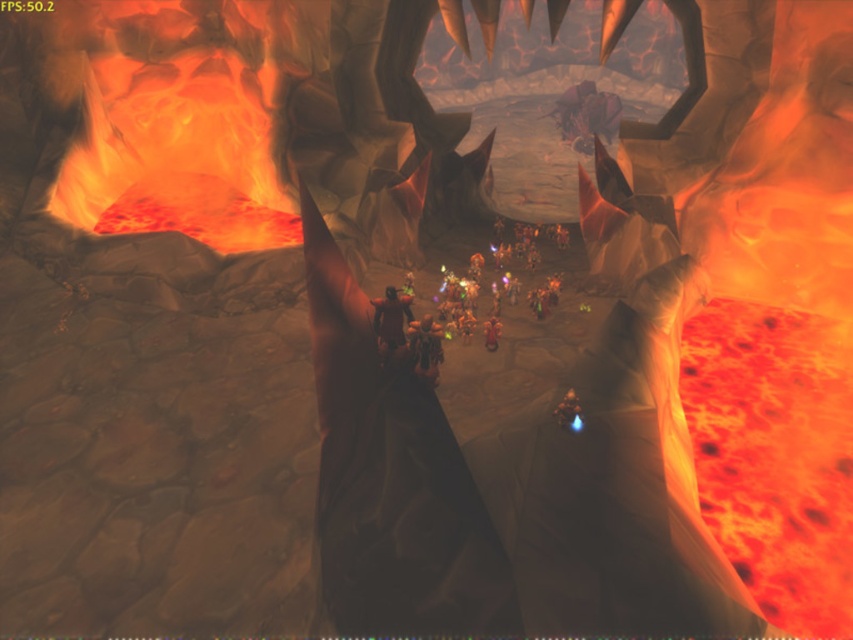
Between point (192, 17) and point (387, 321), which one is positioned behind?

The point (192, 17) is behind.

How much distance is there between lava/molten rock fire at left and dark brown leather armor at center?

They are 4.54 meters apart.

The image size is (853, 640). Identify the location of lava/molten rock fire at left. (178, 140).

Where is `lava/molten rock fire at left`? lava/molten rock fire at left is located at coordinates (178, 140).